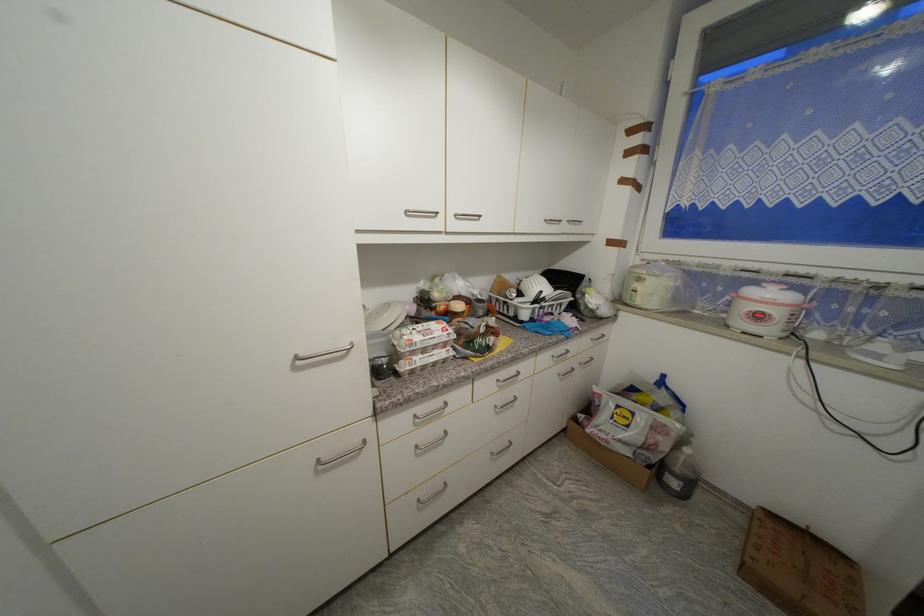
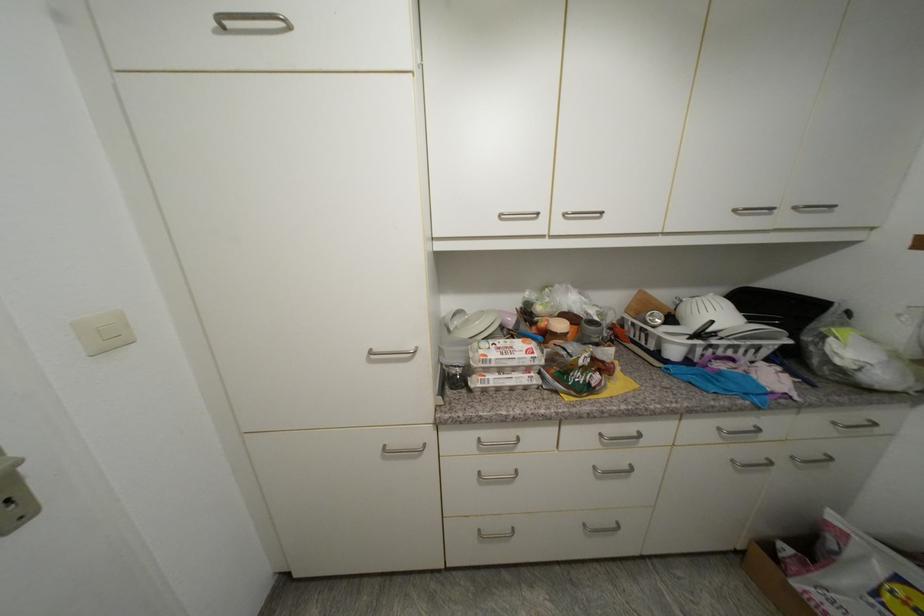
In the second image, find the point that corresponds to [565,376] in the first image.

(738, 463)